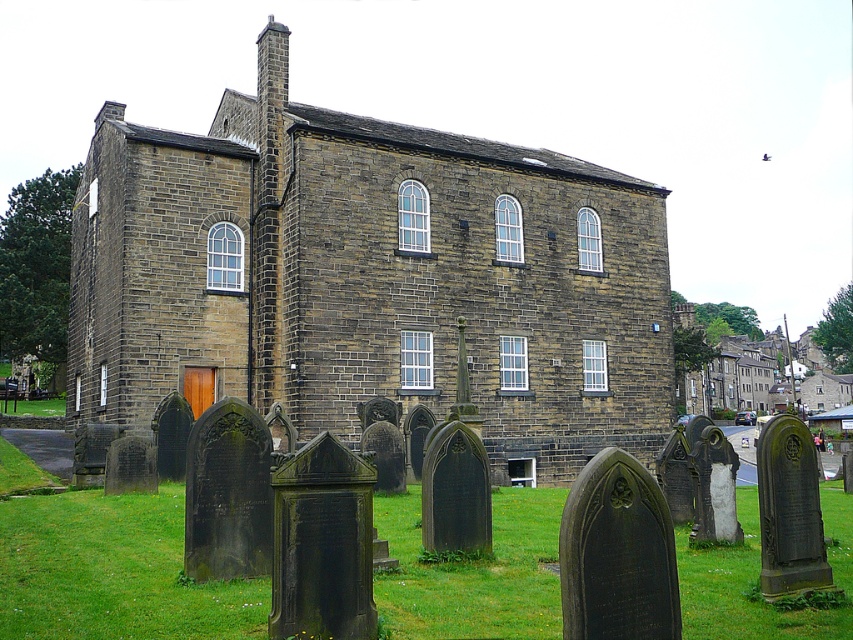
You are standing in a cemetery and want to walk from the green grass at lower center to the brown stone church at center. Which direction should you move in to get closer to the church?

You should move forward because the brown stone church at center is further away from you than the green grass at lower center, so moving forward will bring you closer to it.

You are standing in front of the building and want to take a photo that includes both point (601, 400) and point (541, 541). Which point should you focus on first to ensure both are in focus?

You should focus on point (541, 541) first because it is closer to the camera than point (601, 400), ensuring both points are within the depth of field.

You are standing on the green grass at lower center and want to enter the brown stone church at center. Which direction should you walk to reach the entrance?

The brown stone church at center is positioned over green grass at lower center, so you should walk towards the direction of the church to reach its entrance.